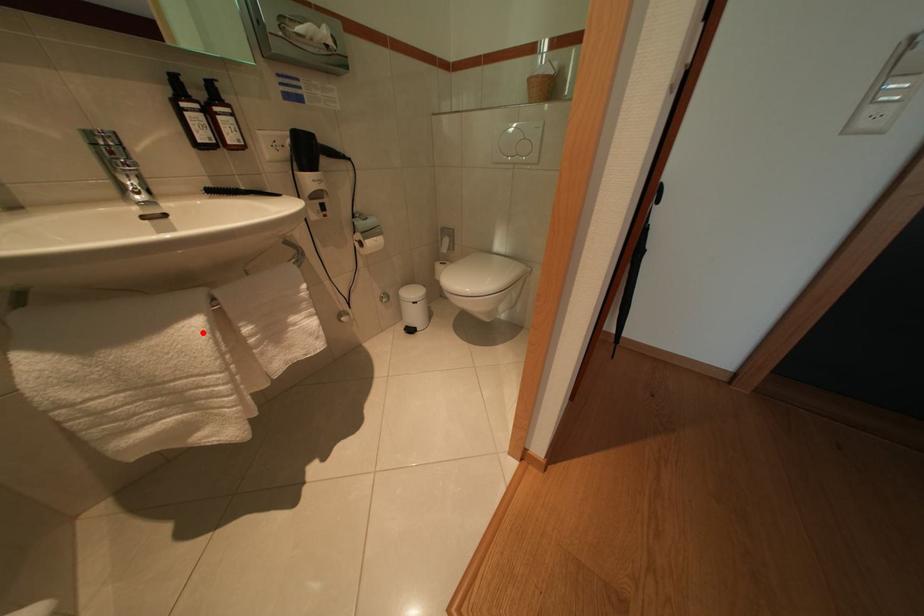
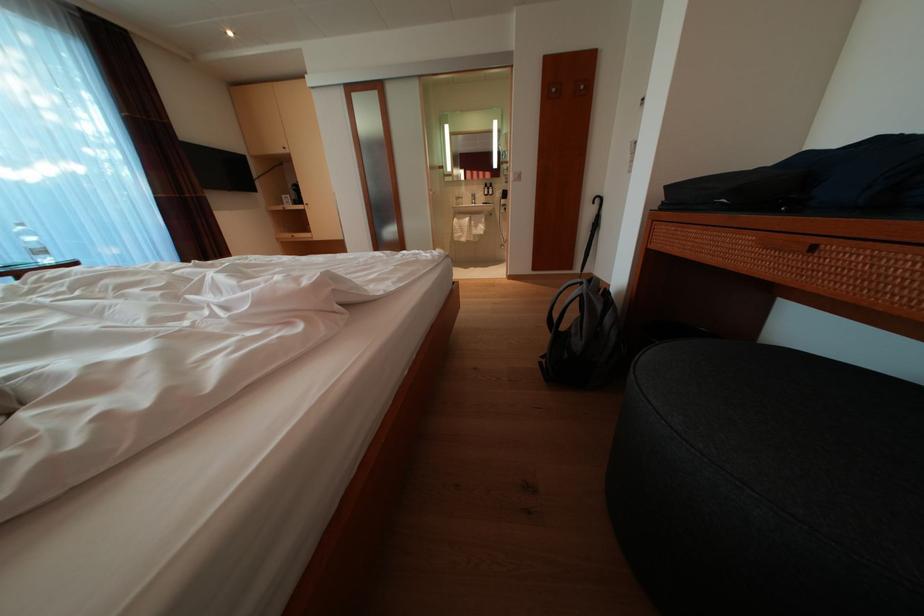
Where in the second image is the point corresponding to the highlighted location from the first image?

(476, 225)